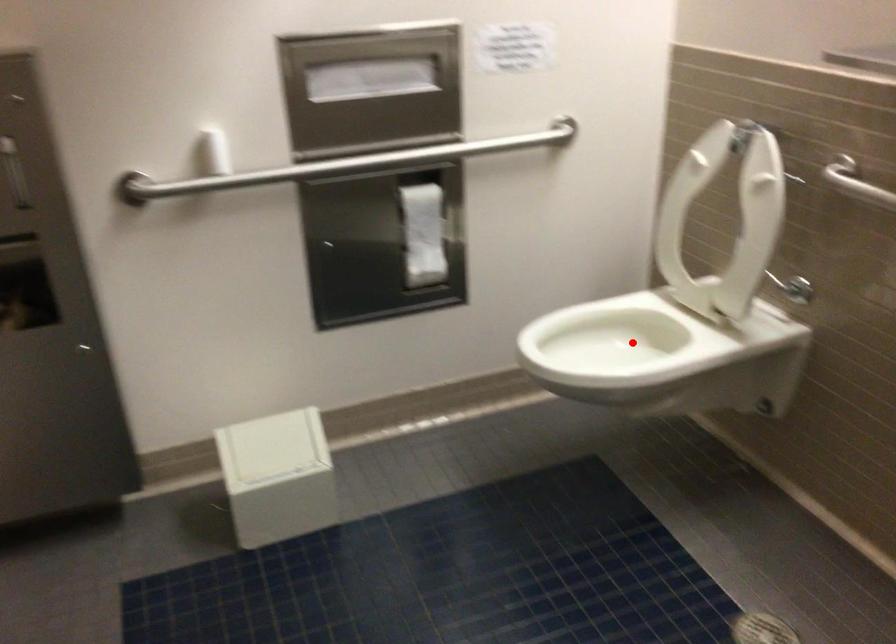
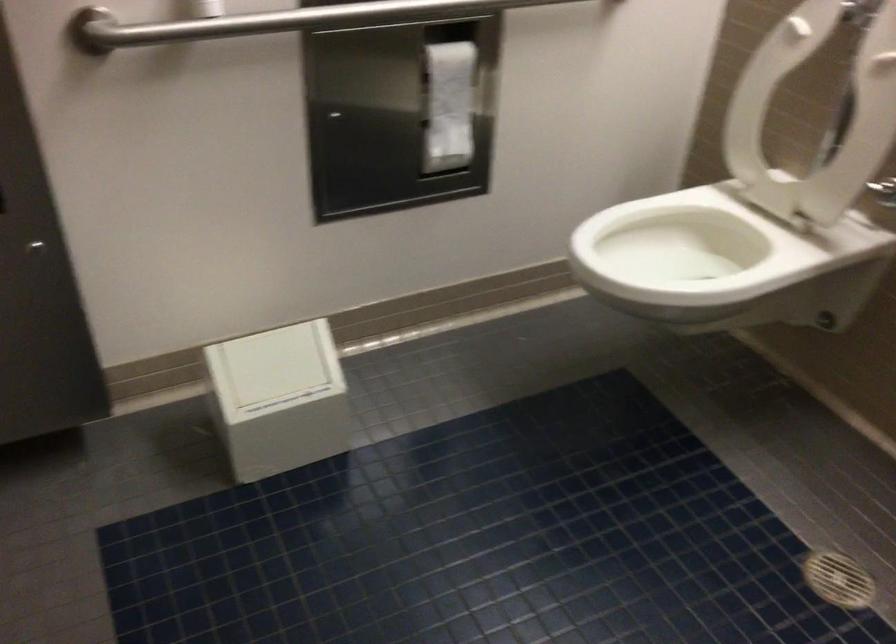
Question: I am providing you with two images of the same scene from different viewpoints. Image1 has a red point marked. In image2, the corresponding 3D location appears at what relative position? Reply with the corresponding letter.

Choices:
 (A) Closer
 (B) Farther

Answer: (A)